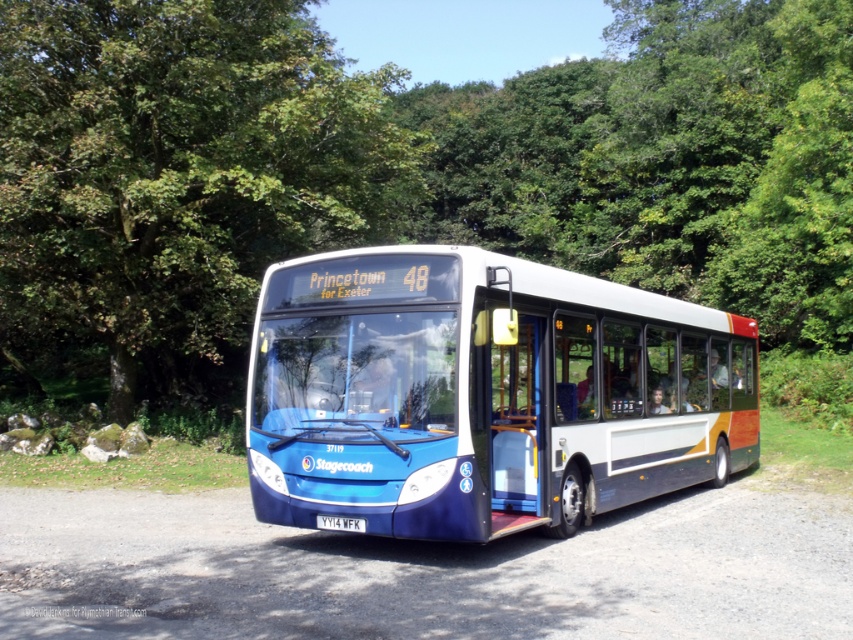
Question: Which object appears farthest from the camera in this image?

Choices:
 (A) blue metallic bus at center
 (B) green leafy tree at center

Answer: (B)

Question: Is green leafy tree at center further to the viewer compared to blue metallic bus at center?

Choices:
 (A) no
 (B) yes

Answer: (B)

Question: From the image, what is the correct spatial relationship of green leafy tree at center in relation to blue metallic bus at center?

Choices:
 (A) below
 (B) above

Answer: (B)

Question: Is green leafy tree at center behind blue metallic bus at center?

Choices:
 (A) no
 (B) yes

Answer: (B)